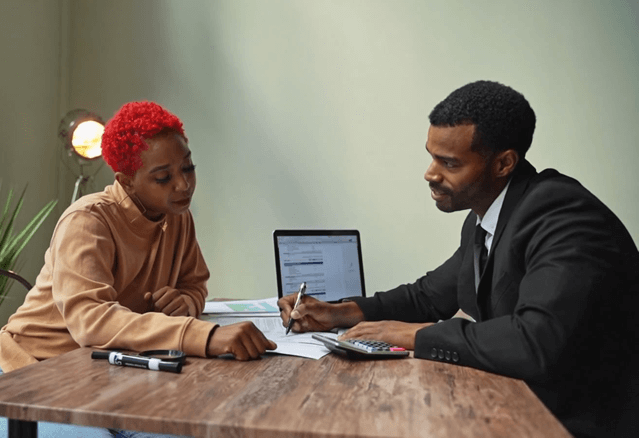
Where is `green plant`? green plant is located at coordinates (12, 244).